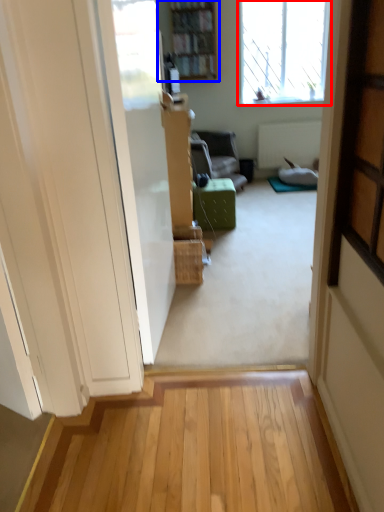
Question: Which point is further to the camera, window (highlighted by a red box) or bookcase (highlighted by a blue box)?

Choices:
 (A) window
 (B) bookcase

Answer: (A)